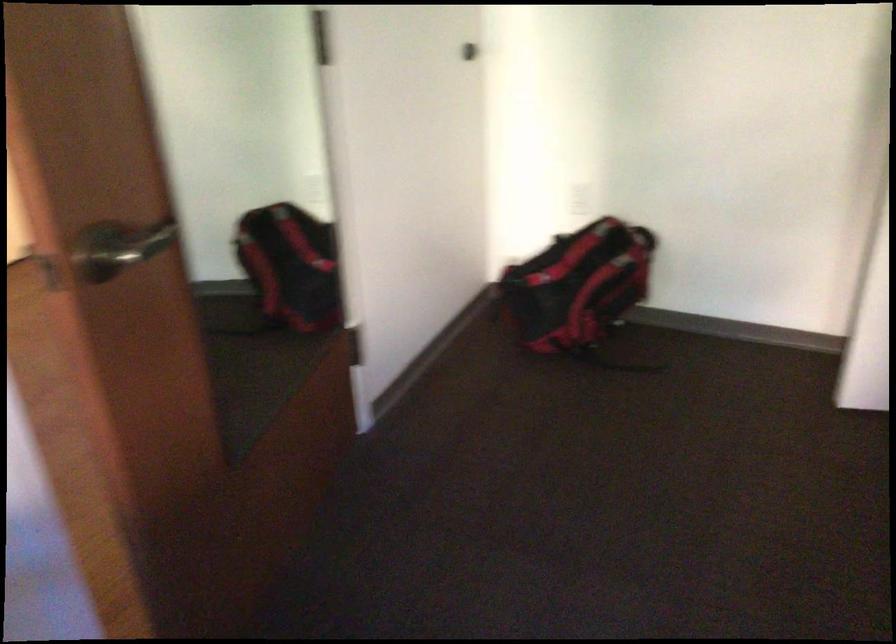
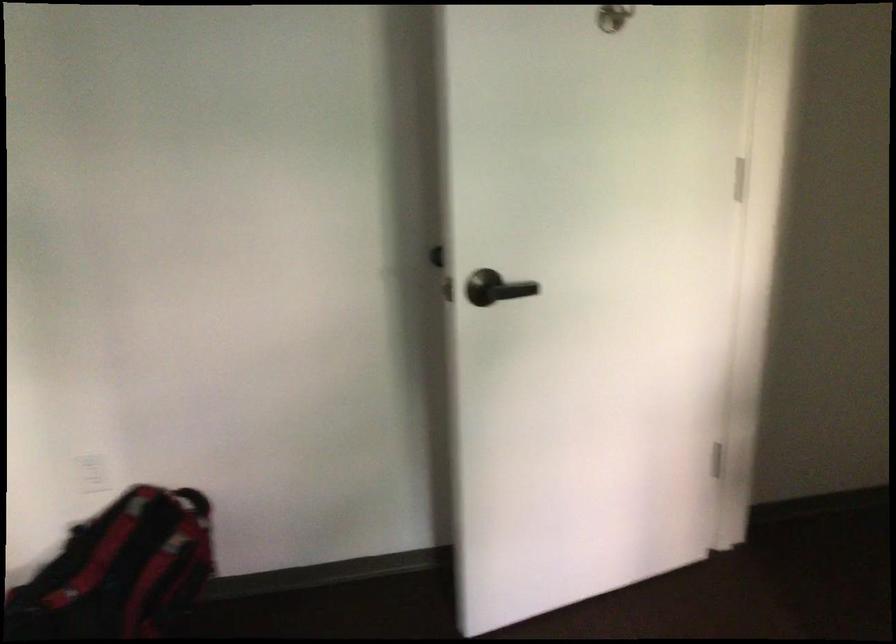
Question: Based on the continuous images, in which direction is the camera rotating? Reply with the corresponding letter.

Choices:
 (A) Left
 (B) Right
 (C) Up
 (D) Down

Answer: (B)